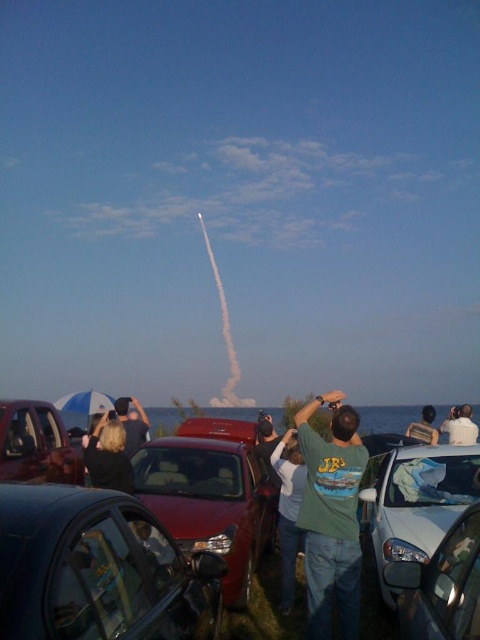
You are standing at the rocket launch viewing area and want to take a photo of the two points in the scene. Which point, point (159, 529) or point (132, 436), is closer to you?

Point (159, 529) is closer to the camera than point (132, 436), so it is closer to you.

You are standing at the dark hair at center and want to reach the metallic silver car at lower right to retrieve your bag. Is the distance between you and the car sufficient to walk directly to it without needing to detour around any obstacles?

The metallic silver car at lower right is 3.13 meters away from dark hair at center. Since this distance is within a reasonable walking range, you can walk directly to the car without needing to detour around obstacles.